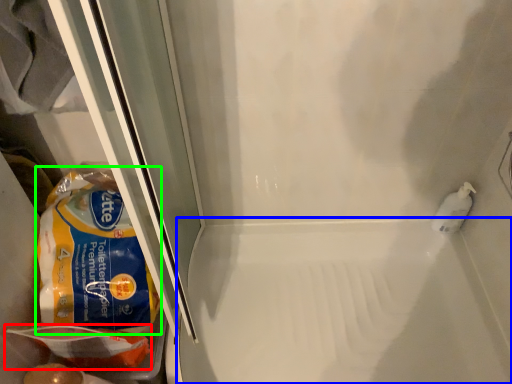
Question: Considering the real-world distances, which object is farthest from food (highlighted by a red box)? bath (highlighted by a blue box) or cereal (highlighted by a green box)?

Choices:
 (A) bath
 (B) cereal

Answer: (A)